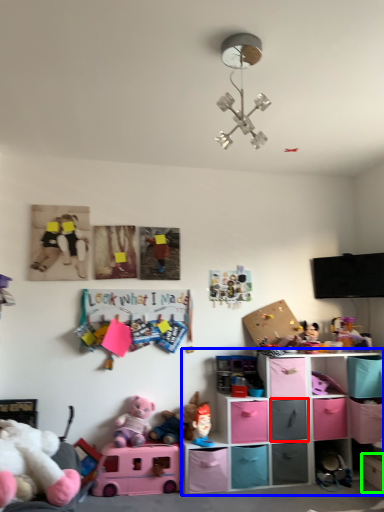
Question: Estimate the real-world distances between objects in this image. Which object is farther from shelf (highlighted by a red box), shelf (highlighted by a blue box) or shelf (highlighted by a green box)?

Choices:
 (A) shelf
 (B) shelf

Answer: (B)